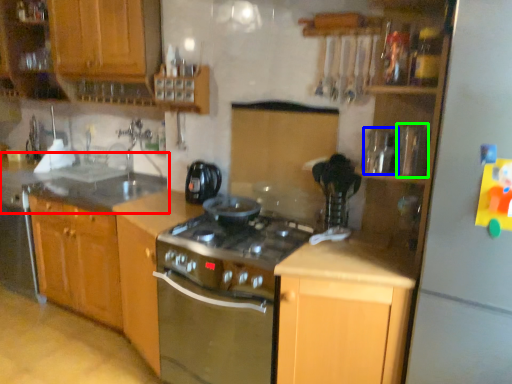
Question: Estimate the real-world distances between objects in this image. Which object is farther from countertop (highlighted by a red box), appliance (highlighted by a blue box) or appliance (highlighted by a green box)?

Choices:
 (A) appliance
 (B) appliance

Answer: (B)